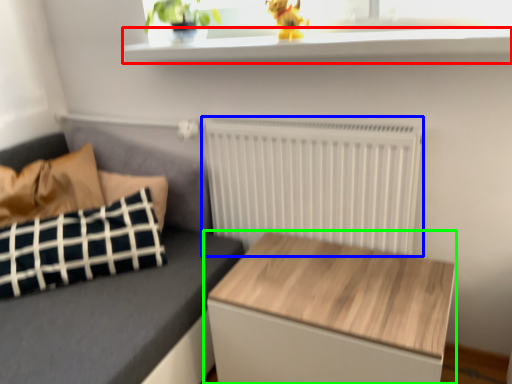
Question: Considering the real-world distances, which object is farthest from window sill (highlighted by a red box)? radiator (highlighted by a blue box) or table (highlighted by a green box)?

Choices:
 (A) radiator
 (B) table

Answer: (B)